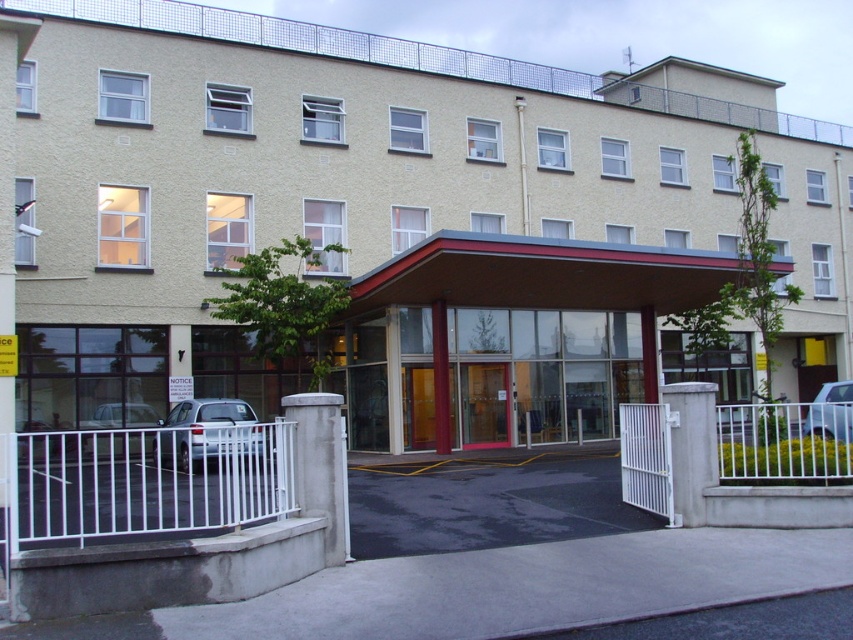
Question: Is matte glass entrance at center positioned behind satin silver car at lower left?

Choices:
 (A) yes
 (B) no

Answer: (A)

Question: Can you confirm if matte glass entrance at center is positioned to the right of wooden door at center?

Choices:
 (A) yes
 (B) no

Answer: (A)

Question: Estimate the real-world distances between objects in this image. Which object is closer to the white metallic car at center?

Choices:
 (A) wooden door at center
 (B) silver metallic car at left

Answer: (A)

Question: Which point is farther to the camera?

Choices:
 (A) silver metallic car at left
 (B) wooden door at center
 (C) matte glass entrance at center

Answer: (B)

Question: Does matte glass entrance at center appear under silver metallic car at left?

Choices:
 (A) yes
 (B) no

Answer: (B)

Question: Which of the following is the closest to the observer?

Choices:
 (A) (x=474, y=440)
 (B) (x=119, y=124)

Answer: (A)